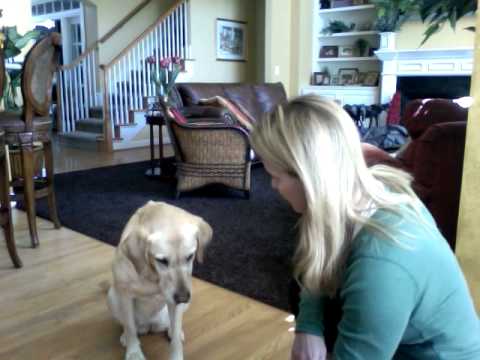
The width and height of the screenshot is (480, 360). In order to click on stair rails in this screenshot , I will do `click(78, 61)`, `click(106, 69)`.